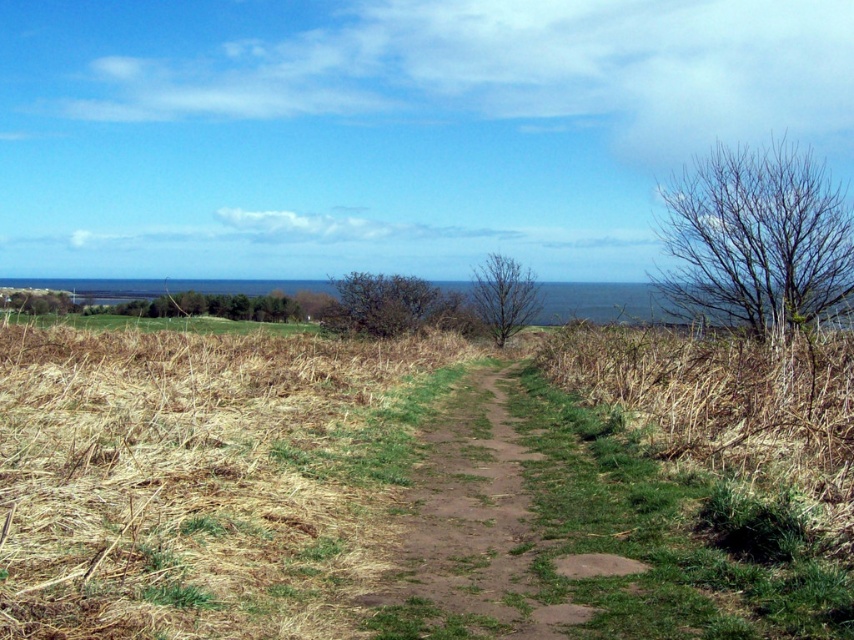
Question: Is brown textured bush at center positioned before bare branches at center?

Choices:
 (A) no
 (B) yes

Answer: (B)

Question: Which object appears closest to the camera in this image?

Choices:
 (A) dirt path at center
 (B) green leafy tree at center
 (C) brown textured bush at center

Answer: (A)

Question: Does bare branches at upper right have a greater width compared to green leafy tree at upper left?

Choices:
 (A) yes
 (B) no

Answer: (A)

Question: Among these objects, which one is nearest to the camera?

Choices:
 (A) dirt path at center
 (B) bare branches at center

Answer: (A)

Question: Which object appears closest to the camera in this image?

Choices:
 (A) dirt path at center
 (B) green leafy tree at upper left

Answer: (A)

Question: Can you confirm if bare branches at upper right is positioned above green leafy tree at center?

Choices:
 (A) yes
 (B) no

Answer: (A)